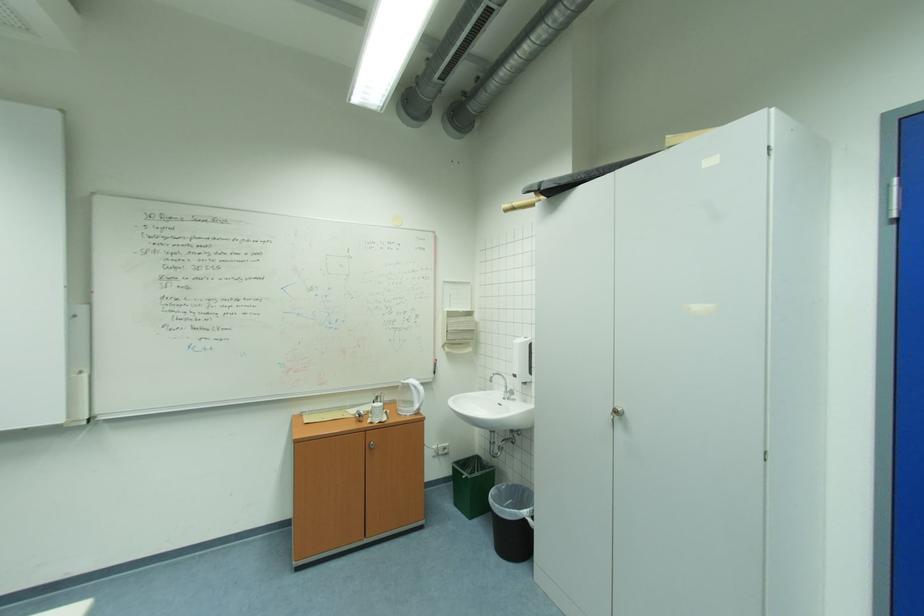
This screenshot has width=924, height=616. Identify the location of black trash can. (512, 521).